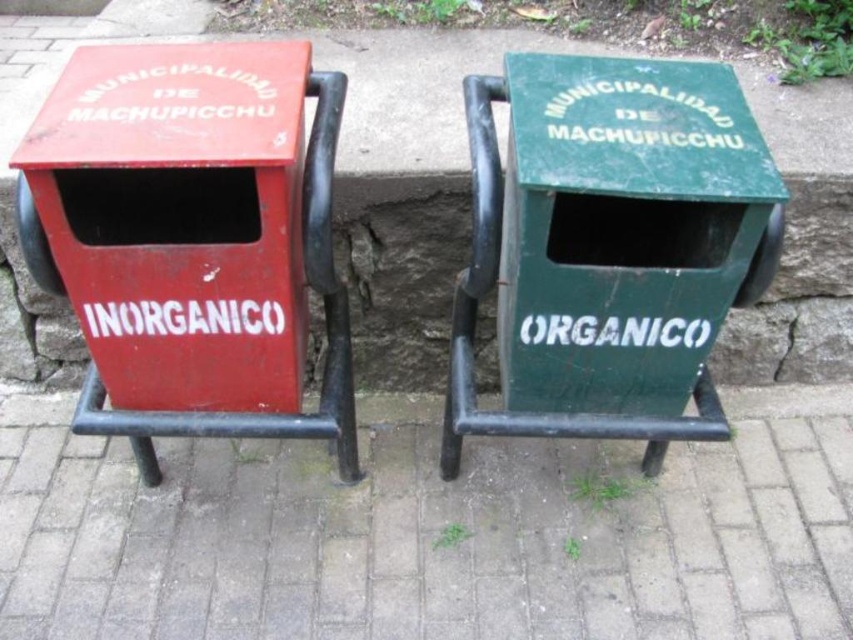
You are standing on the gray concrete pavement at center and want to place a banana peel into the correct recycling bin. Which bin should you use and why?

You should use the green bin labeled ORGANICO because banana peels are organic waste. The gray concrete pavement at center is located at point [430,532], so you are positioned centrally between the two bins. The green bin on the right is for organic waste, making it the correct choice for the banana peel.

You are a city planner reviewing the layout of a public space. You notice the gray concrete pavement at center and the metallic trash bin at center. Which of these two items occupies more area in the scene?

The gray concrete pavement at center has a larger size compared to the metallic trash bin at center, so it occupies more area in the scene.